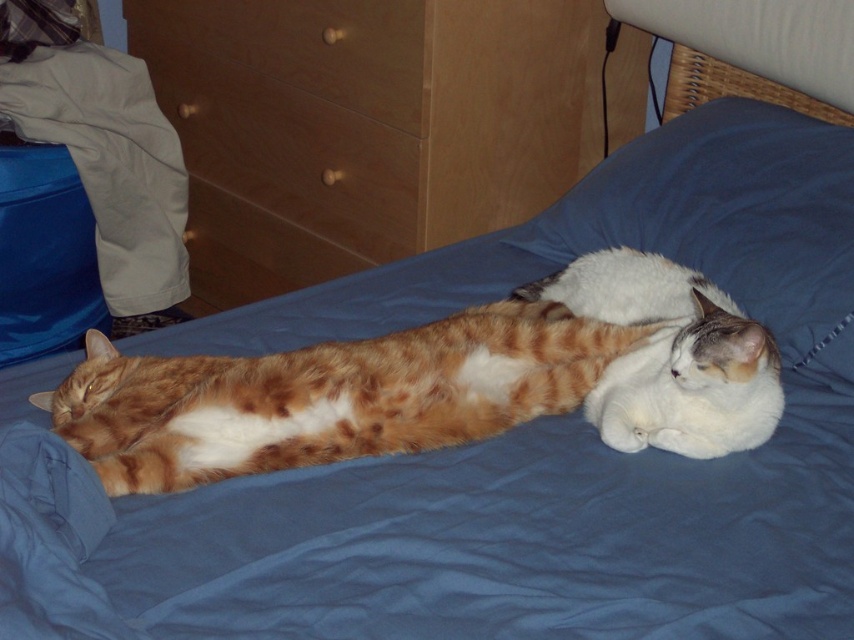
Does wooden dresser at upper left have a greater height compared to wooden drawer at upper left?

Yes, wooden dresser at upper left is taller than wooden drawer at upper left.

Does wooden dresser at upper left appear on the right side of wooden drawer at upper left?

Yes, wooden dresser at upper left is to the right of wooden drawer at upper left.

Describe the element at coordinates (366, 125) in the screenshot. I see `wooden dresser at upper left` at that location.

Find the location of a particular element. The height and width of the screenshot is (640, 854). wooden dresser at upper left is located at coordinates (366, 125).

Is white soft pillow at center positioned behind wooden drawer at upper center?

That is False.

Does white soft pillow at center have a greater width compared to wooden drawer at upper center?

Incorrect, white soft pillow at center's width does not surpass wooden drawer at upper center's.

You are a GUI agent. You are given a task and a screenshot of the screen. Output one action in this format:
    pyautogui.click(x=<x>, y=<y>)
    Task: Click on the white soft pillow at center
    The image size is (854, 640).
    Given the screenshot: What is the action you would take?
    pyautogui.click(x=732, y=218)

In the scene shown: Is wooden dresser at upper left to the left of wooden drawer at upper center from the viewer's perspective?

No, wooden dresser at upper left is not to the left of wooden drawer at upper center.

Between wooden dresser at upper left and wooden drawer at upper center, which one is positioned lower?

wooden dresser at upper left is lower down.

Between point (501, 144) and point (297, 45), which one is positioned behind?

Point (297, 45)

At what (x,y) coordinates should I click in order to perform the action: click on wooden dresser at upper left. Please return your answer as a coordinate pair (x, y). The width and height of the screenshot is (854, 640). Looking at the image, I should click on (366, 125).